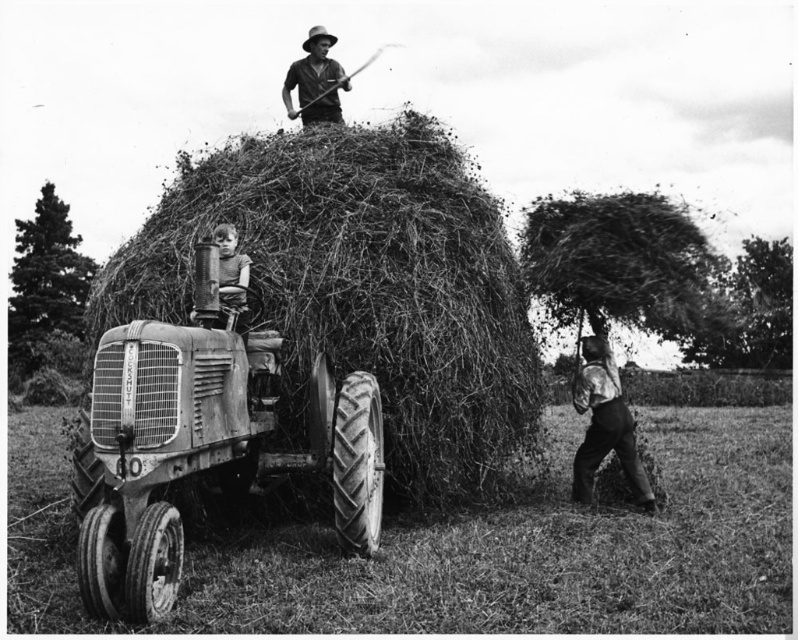
Is rusty metal tractor at center above smooth leather pants at lower right?

Yes, rusty metal tractor at center is above smooth leather pants at lower right.

Between rusty metal tractor at center and smooth leather pants at lower right, which one has more height?

rusty metal tractor at center is taller.

Who is more forward, (141, 483) or (595, 374)?

Point (141, 483) is more forward.

Locate an element on the screen. The height and width of the screenshot is (640, 798). rusty metal tractor at center is located at coordinates (202, 445).

Between smooth wooden stick at upper center and smooth wooden stick at center, which one has more height?

Answer: smooth wooden stick at upper center is taller.

From the picture: Is smooth wooden stick at upper center above smooth wooden stick at center?

Indeed, smooth wooden stick at upper center is positioned over smooth wooden stick at center.

This screenshot has width=798, height=640. Find the location of `smooth wooden stick at upper center`. smooth wooden stick at upper center is located at coordinates (315, 81).

Does smooth leather pants at lower right come in front of smooth wooden stick at upper center?

Yes, it is in front of smooth wooden stick at upper center.

Looking at this image, can you confirm if smooth leather pants at lower right is bigger than smooth wooden stick at upper center?

No, smooth leather pants at lower right is not bigger than smooth wooden stick at upper center.

Who is more forward, (x=579, y=381) or (x=315, y=104)?

Positioned in front is point (x=579, y=381).

Find the location of a particular element. The image size is (798, 640). smooth leather pants at lower right is located at coordinates (603, 424).